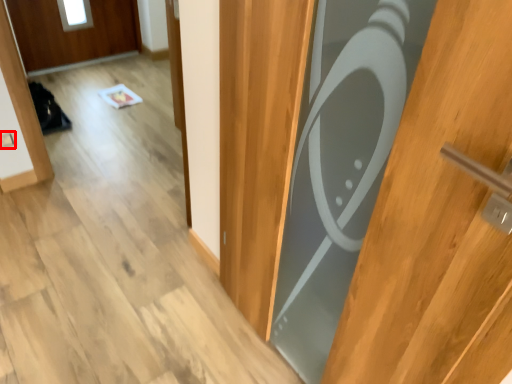
Question: From the image's perspective, what is the correct spatial relationship of electric outlet (annotated by the red box) in relation to door?

Choices:
 (A) below
 (B) above

Answer: (B)